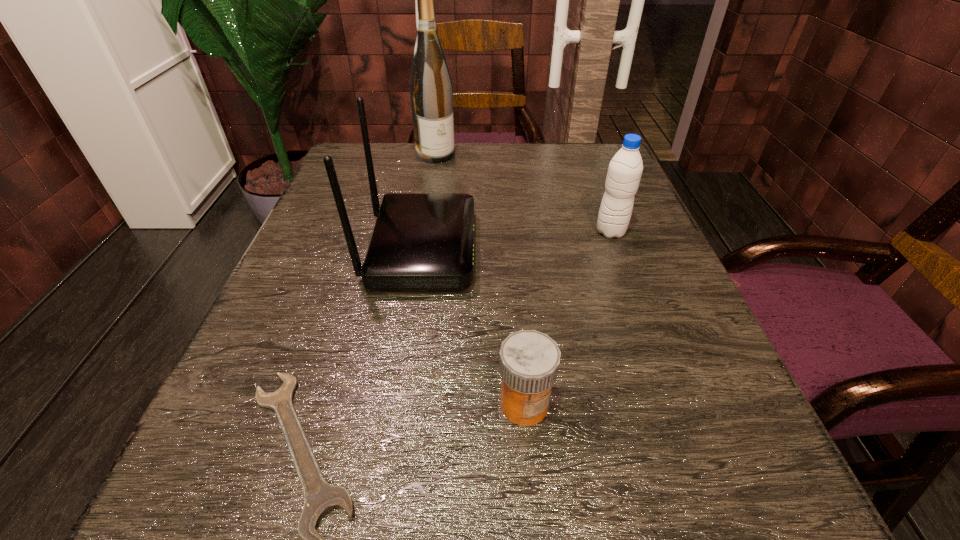
What are the coordinates of `vacant region located on the label side of the second shortest object` in the screenshot? It's located at (530, 468).

At what (x,y) coordinates should I click in order to perform the action: click on object that is at the far edge. Please return your answer as a coordinate pair (x, y). The height and width of the screenshot is (540, 960). Looking at the image, I should click on click(430, 85).

Where is `object present at the left edge`? The width and height of the screenshot is (960, 540). object present at the left edge is located at coordinates (420, 240).

Find the location of a particular element. The height and width of the screenshot is (540, 960). object located at the right edge is located at coordinates (625, 169).

This screenshot has width=960, height=540. What are the coordinates of `free space at the far edge` in the screenshot? It's located at (536, 174).

This screenshot has height=540, width=960. Find the location of `vacant space at the near edge of the desktop`. vacant space at the near edge of the desktop is located at coordinates (602, 500).

I want to click on free space at the left edge, so click(339, 240).

This screenshot has height=540, width=960. Find the location of `vacant space at the right edge of the desktop`. vacant space at the right edge of the desktop is located at coordinates (575, 198).

At what (x,y) coordinates should I click in order to perform the action: click on vacant region at the far left corner of the desktop. Please return your answer as a coordinate pair (x, y). Looking at the image, I should click on (356, 166).

At what (x,y) coordinates should I click in order to perform the action: click on free space at the near right corner. Please return your answer as a coordinate pair (x, y). The image size is (960, 540). Looking at the image, I should click on (702, 512).